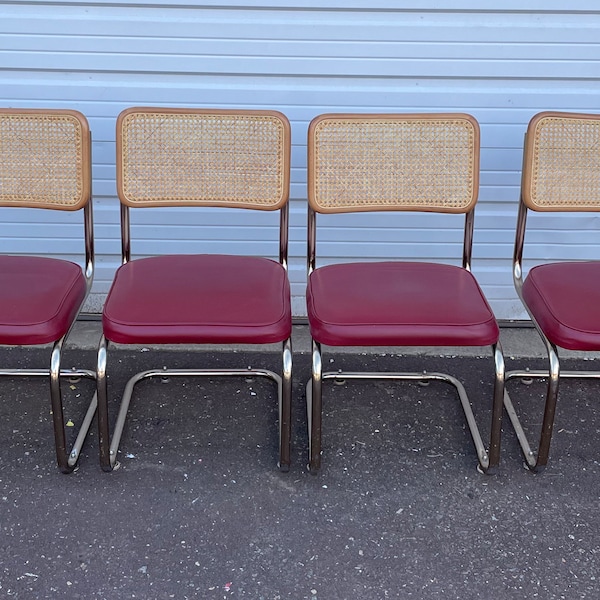
Locate an element on the screen. breakfast chairs is located at coordinates (383, 310).